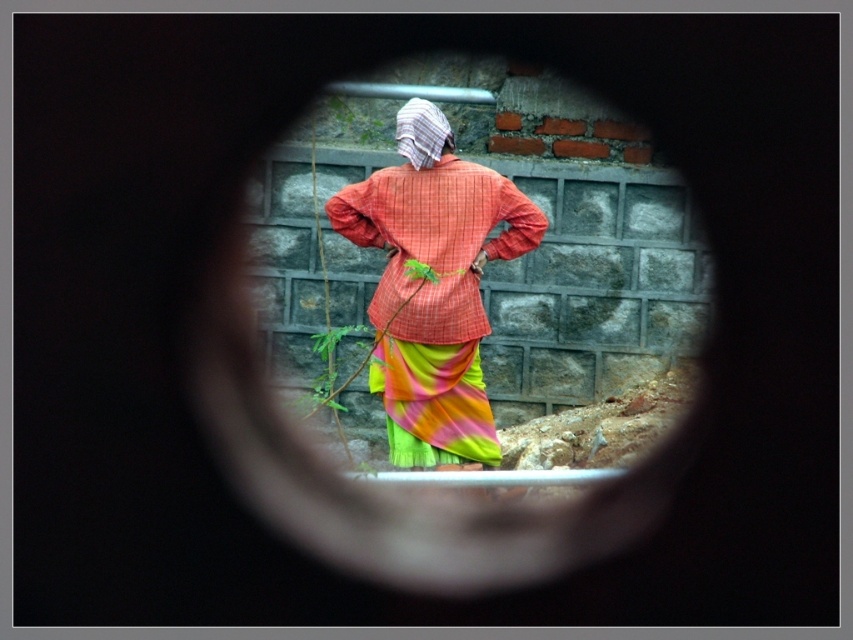
Can you confirm if matte glass hole at center is positioned below textured orange shirt at center?

Actually, matte glass hole at center is above textured orange shirt at center.

Who is more distant from viewer, (529,180) or (418,417)?

The point (529,180) is more distant.

This screenshot has width=853, height=640. Find the location of `matte glass hole at center`. matte glass hole at center is located at coordinates (589, 280).